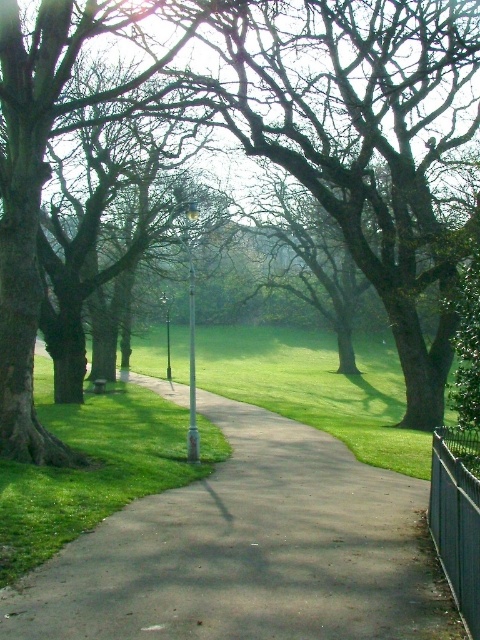
Is point (451, 579) in front of point (190, 381)?

Yes, point (451, 579) is in front of point (190, 381).

Can you confirm if black metal fence at right is wider than green metallic pole at center?

No.

Does point (469, 627) come farther from viewer compared to point (192, 458)?

No, it is in front of (192, 458).

The image size is (480, 640). What are the coordinates of `black metal fence at right` in the screenshot? It's located at (456, 524).

Is black metal fence at right smaller than metallic pole at center?

Yes, black metal fence at right is smaller than metallic pole at center.

Measure the distance from black metal fence at right to metallic pole at center.

black metal fence at right is 180.56 feet away from metallic pole at center.

This screenshot has width=480, height=640. What do you see at coordinates (456, 524) in the screenshot? I see `black metal fence at right` at bounding box center [456, 524].

Where is `black metal fence at right`? Image resolution: width=480 pixels, height=640 pixels. black metal fence at right is located at coordinates (456, 524).

Is smooth asphalt path at center shorter than green metallic pole at center?

Yes, smooth asphalt path at center is shorter than green metallic pole at center.

Who is positioned more to the right, smooth asphalt path at center or green metallic pole at center?

From the viewer's perspective, smooth asphalt path at center appears more on the right side.

At what (x,y) coordinates should I click in order to perform the action: click on smooth asphalt path at center. Please return your answer as a coordinate pair (x, y). The width and height of the screenshot is (480, 640). Looking at the image, I should click on (x=249, y=552).